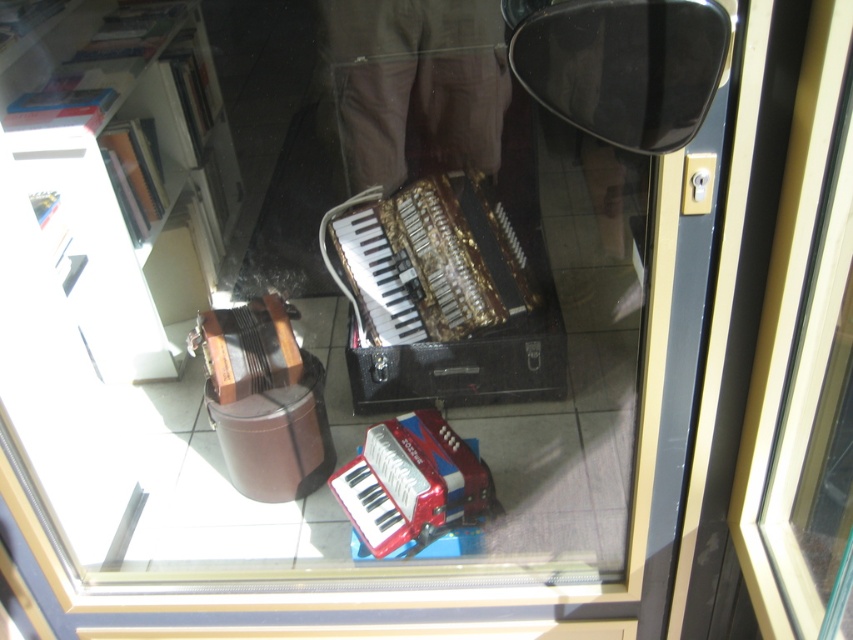
Question: Is gold metallic accordion at center thinner than metallic red accordion at center?

Choices:
 (A) yes
 (B) no

Answer: (B)

Question: Observing the image, what is the correct spatial positioning of white glossy bookshelf at upper left in reference to metallic red accordion at center?

Choices:
 (A) left
 (B) right

Answer: (A)

Question: Which object is positioned closest to the metallic red accordion at center?

Choices:
 (A) white glossy bookshelf at upper left
 (B) gold metallic accordion at center

Answer: (B)

Question: Considering the real-world distances, which object is closest to the gold metallic accordion at center?

Choices:
 (A) white glossy bookshelf at upper left
 (B) metallic red accordion at center

Answer: (B)

Question: Among these objects, which one is nearest to the camera?

Choices:
 (A) gold metallic accordion at center
 (B) white glossy bookshelf at upper left

Answer: (B)

Question: Can you confirm if white glossy bookshelf at upper left is positioned below metallic red accordion at center?

Choices:
 (A) no
 (B) yes

Answer: (A)